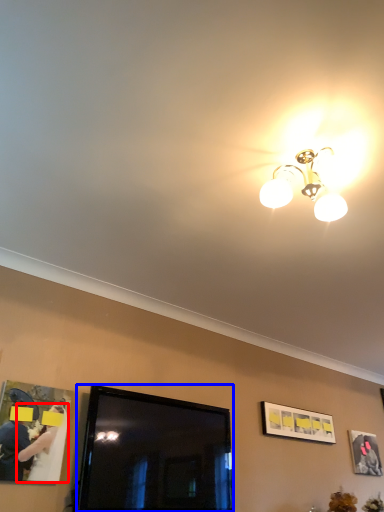
Question: Which point is closer to the camera, woman (highlighted by a red box) or television (highlighted by a blue box)?

Choices:
 (A) woman
 (B) television

Answer: (A)